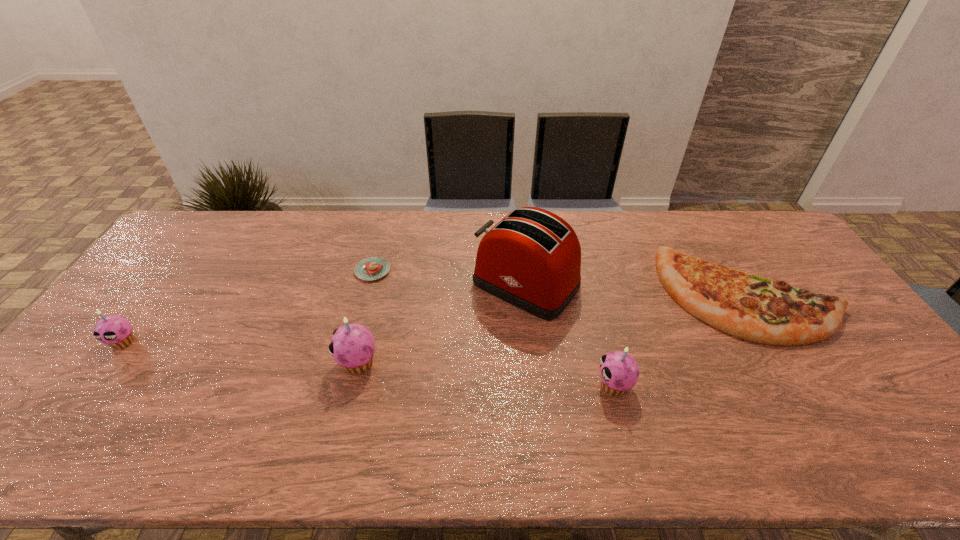
At what (x,y) coordinates should I click in order to perform the action: click on vacant space located 0.100m on the face of the second cupcake from right to left. Please return your answer as a coordinate pair (x, y). This screenshot has width=960, height=540. Looking at the image, I should click on (300, 362).

At what (x,y) coordinates should I click in order to perform the action: click on vacant area located 0.210m on the face of the second cupcake from right to left. Please return your answer as a coordinate pair (x, y). Looking at the image, I should click on (257, 362).

The height and width of the screenshot is (540, 960). Identify the location of vacant space situated on the face of the second cupcake from right to left. pyautogui.click(x=296, y=362).

Where is `vacant space located on the face of the rightmost cupcake`? This screenshot has width=960, height=540. vacant space located on the face of the rightmost cupcake is located at coordinates (447, 385).

At what (x,y) coordinates should I click in order to perform the action: click on vacant region located on the face of the rightmost cupcake. Please return your answer as a coordinate pair (x, y). This screenshot has height=540, width=960. Looking at the image, I should click on (532, 385).

This screenshot has width=960, height=540. I want to click on vacant space situated on the face of the rightmost cupcake, so click(x=536, y=385).

The width and height of the screenshot is (960, 540). What are the coordinates of `vacant space situated on the right of the pastry` in the screenshot? It's located at (506, 271).

What are the coordinates of `free spot located 0.060m on the left of the pizza` in the screenshot? It's located at (646, 295).

Where is `vacant space located 0.150m on the left of the tallest object`? The image size is (960, 540). vacant space located 0.150m on the left of the tallest object is located at coordinates [x=423, y=285].

The width and height of the screenshot is (960, 540). Identify the location of object that is positioned at the far edge. (531, 259).